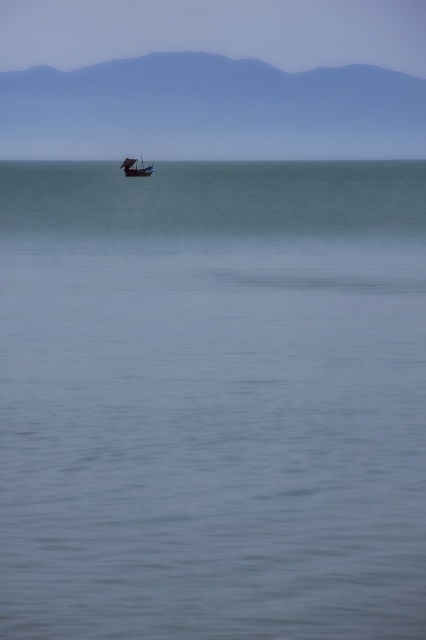
Is point (221, 604) closer to viewer compared to point (149, 170)?

That is True.

Does blue smooth water at center have a smaller size compared to wooden boat at center?

No.

The image size is (426, 640). Find the location of `blue smooth water at center`. blue smooth water at center is located at coordinates (213, 401).